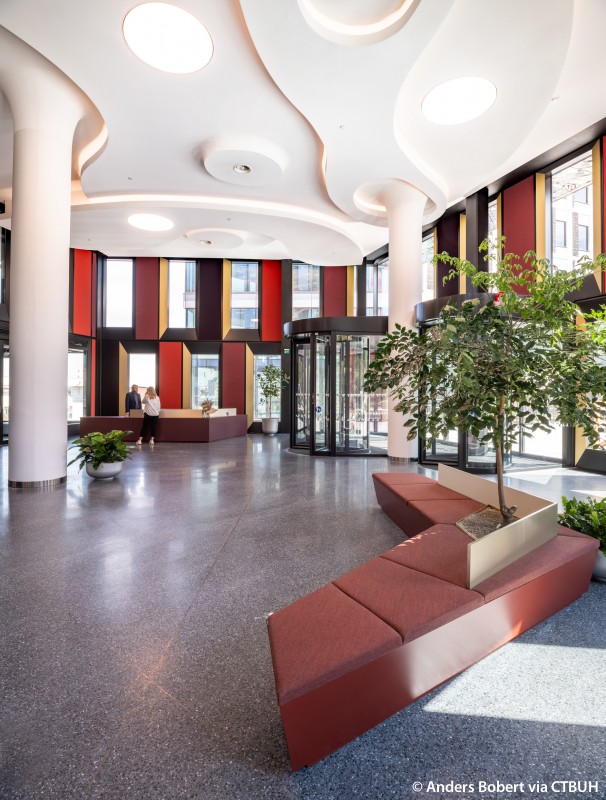
At what (x,y) coordinates should I click in order to perform the action: click on pillar. Please return your answer as a coordinate pair (x, y). The width and height of the screenshot is (606, 800). Looking at the image, I should click on (413, 277), (35, 349).